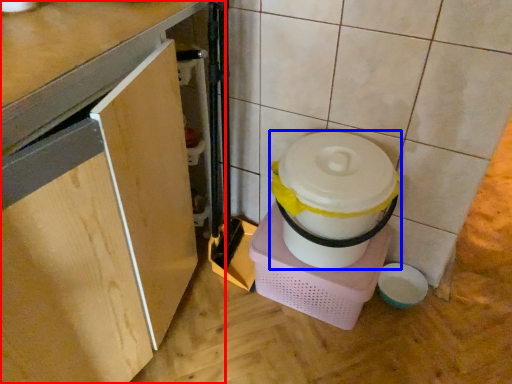
Question: Among these objects, which one is nearest to the camera, cabinetry (highlighted by a red box) or appliance (highlighted by a blue box)?

Choices:
 (A) cabinetry
 (B) appliance

Answer: (A)